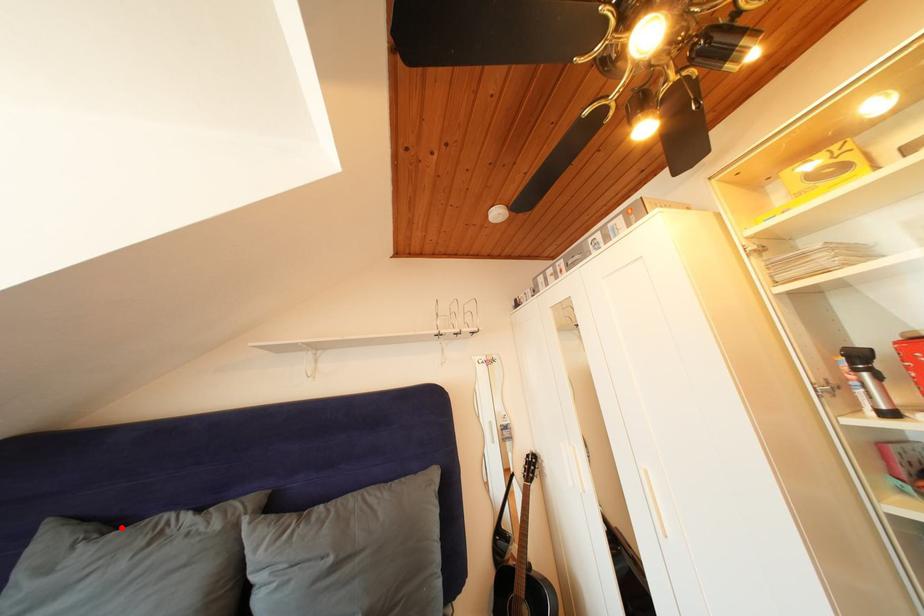
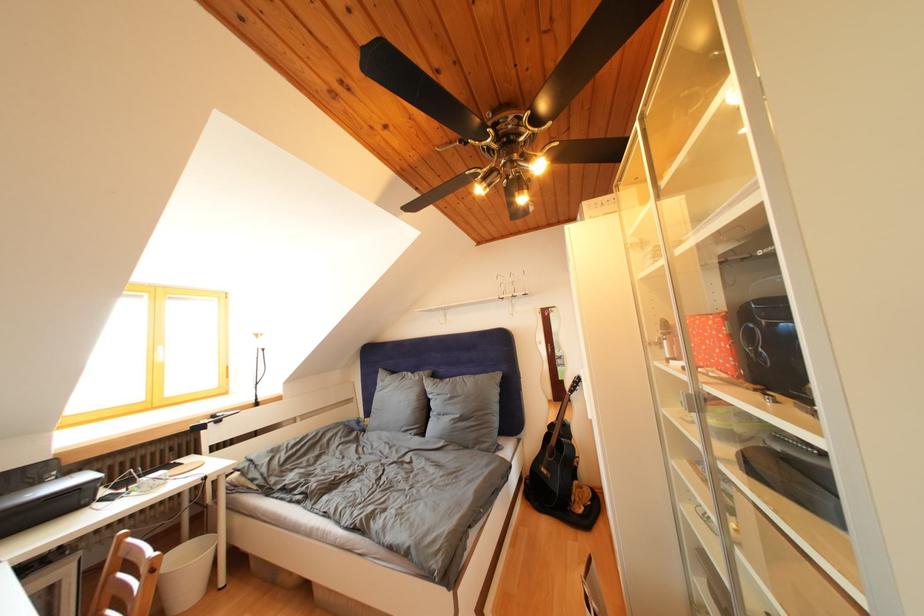
Question: I am providing you with two images of the same scene from different viewpoints. A red point is marked on the first image. Can you still see the location of the red point in image 2?

Choices:
 (A) Yes
 (B) No

Answer: (A)